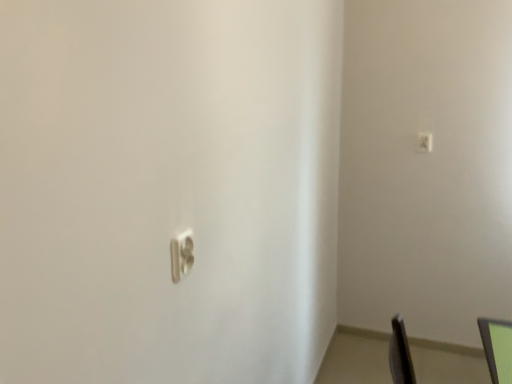
Question: Does point (481, 336) appear closer or farther from the camera than point (190, 268)?

Choices:
 (A) farther
 (B) closer

Answer: (A)

Question: Relative to white plastic light switch at center, the 2th light switch viewed from the top, is green matte monitor at lower right in front or behind?

Choices:
 (A) behind
 (B) front

Answer: (B)

Question: Estimate the real-world distances between objects in this image. Which object is farther from the satin silver switch at upper right, the 1th light switch viewed from the top?

Choices:
 (A) green matte monitor at lower right
 (B) white plastic light switch at center, which ranks as the second light switch in back-to-front order

Answer: (B)

Question: Considering the real-world distances, which object is farthest from the white plastic light switch at center, the first light switch from the bottom?

Choices:
 (A) satin silver switch at upper right, the 1th light switch viewed from the top
 (B) green matte monitor at lower right

Answer: (A)